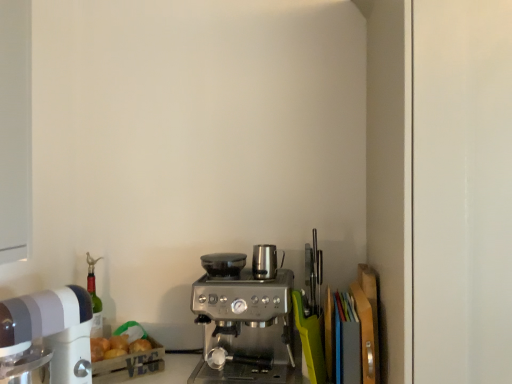
Describe the element at coordinates (52, 329) in the screenshot. I see `white plastic mixer at left` at that location.

Measure the distance between satin silver coffee maker at center and camera.

satin silver coffee maker at center and camera are 4.05 feet apart from each other.

The image size is (512, 384). Describe the element at coordinates (223, 264) in the screenshot. I see `satin silver espresso machine at center, acting as the 1th appliance starting from the left` at that location.

Where is `white plastic mixer at left`? This screenshot has width=512, height=384. white plastic mixer at left is located at coordinates (52, 329).

Which of these two, satin silver coffee maker at center or satin silver espresso machine at center, the 2th appliance positioned from the right, stands taller?

With more height is satin silver coffee maker at center.

Does satin silver coffee maker at center have a smaller size compared to satin silver espresso machine at center, acting as the 1th appliance starting from the left?

Actually, satin silver coffee maker at center might be larger than satin silver espresso machine at center, acting as the 1th appliance starting from the left.

In the scene shown: Is satin silver coffee maker at center positioned with its back to satin silver espresso machine at center, the 2th appliance positioned from the right?

No, satin silver coffee maker at center is not facing away from satin silver espresso machine at center, the 2th appliance positioned from the right.

Does satin silver coffee maker at center have a lesser width compared to satin silver espresso machine at center, the 2th appliance positioned from the right?

No, satin silver coffee maker at center is not thinner than satin silver espresso machine at center, the 2th appliance positioned from the right.

Between point (204, 257) and point (216, 383), which one is positioned behind?

The point (204, 257) is more distant.

Is satin silver espresso machine at center, acting as the 1th appliance starting from the left, positioned with its back to satin silver coffee maker at center?

No, satin silver coffee maker at center is not at the back of satin silver espresso machine at center, acting as the 1th appliance starting from the left.

Considering the positions of objects satin silver espresso machine at center, acting as the 1th appliance starting from the left, and satin silver coffee maker at center in the image provided, who is in front, satin silver espresso machine at center, acting as the 1th appliance starting from the left, or satin silver coffee maker at center?

Positioned in front is satin silver coffee maker at center.

From a real-world perspective, is white plastic mixer at left located higher than satin silver coffee maker at center?

Yes, from a real-world perspective, white plastic mixer at left is on top of satin silver coffee maker at center.

At what (x,y) coordinates should I click in order to perform the action: click on coffee maker on the right of white plastic mixer at left. Please return your answer as a coordinate pair (x, y). Looking at the image, I should click on (247, 328).

Is white plastic mixer at left bigger than satin silver coffee maker at center?

Incorrect, white plastic mixer at left is not larger than satin silver coffee maker at center.

Is white plastic mixer at left directly adjacent to satin silver coffee maker at center?

No, white plastic mixer at left is not beside satin silver coffee maker at center.

The height and width of the screenshot is (384, 512). In order to click on the 1st appliance above when counting from the white plastic mixer at left (from the image's perspective) in this screenshot , I will do `click(223, 264)`.

How much distance is there between satin silver espresso machine at center, acting as the 1th appliance starting from the left, and white plastic mixer at left?

The distance of satin silver espresso machine at center, acting as the 1th appliance starting from the left, from white plastic mixer at left is 17.66 inches.

Is satin silver espresso machine at center, the 2th appliance positioned from the right, oriented away from white plastic mixer at left?

No, satin silver espresso machine at center, the 2th appliance positioned from the right, is not facing the opposite direction of white plastic mixer at left.

Does point (216, 253) appear closer or farther from the camera than point (25, 317)?

Point (216, 253) is positioned farther from the camera compared to point (25, 317).

Does white plastic mixer at left have a greater height compared to satin silver espresso machine at center, the 2th appliance positioned from the right?

Indeed, white plastic mixer at left has a greater height compared to satin silver espresso machine at center, the 2th appliance positioned from the right.

Is point (60, 370) closer to camera compared to point (233, 255)?

Yes, point (60, 370) is closer to viewer.

Which object is more forward, white plastic mixer at left or satin silver espresso machine at center, acting as the 1th appliance starting from the left?

white plastic mixer at left.

Is white plastic mixer at left not near satin silver espresso machine at center, the 2th appliance positioned from the right?

They are positioned close to each other.

Is satin silver kettle at center, arranged as the 2th appliance when viewed from the left, oriented towards satin silver coffee maker at center?

No, satin silver kettle at center, arranged as the 2th appliance when viewed from the left, is not aimed at satin silver coffee maker at center.

From the image's perspective, relative to satin silver coffee maker at center, is satin silver kettle at center, the 1th appliance in the right-to-left sequence, above or below?

Based on their image positions, satin silver kettle at center, the 1th appliance in the right-to-left sequence, is located above satin silver coffee maker at center.

Is satin silver kettle at center, arranged as the 2th appliance when viewed from the left, at the left side of satin silver coffee maker at center?

Incorrect, satin silver kettle at center, arranged as the 2th appliance when viewed from the left, is not on the left side of satin silver coffee maker at center.

Considering the relative sizes of satin silver kettle at center, the 1th appliance in the right-to-left sequence, and satin silver coffee maker at center in the image provided, is satin silver kettle at center, the 1th appliance in the right-to-left sequence, taller than satin silver coffee maker at center?

No, satin silver kettle at center, the 1th appliance in the right-to-left sequence, is not taller than satin silver coffee maker at center.

Which of these two, satin silver espresso machine at center, the 2th appliance positioned from the right, or satin silver kettle at center, arranged as the 2th appliance when viewed from the left, stands shorter?

With less height is satin silver espresso machine at center, the 2th appliance positioned from the right.

Considering the positions of points (226, 261) and (267, 255), is point (226, 261) farther from camera compared to point (267, 255)?

That is False.

Is satin silver espresso machine at center, the 2th appliance positioned from the right, located outside satin silver kettle at center, arranged as the 2th appliance when viewed from the left?

satin silver espresso machine at center, the 2th appliance positioned from the right, lies outside satin silver kettle at center, arranged as the 2th appliance when viewed from the left,'s area.

Which is more to the right, satin silver espresso machine at center, acting as the 1th appliance starting from the left, or satin silver kettle at center, the 1th appliance in the right-to-left sequence?

Positioned to the right is satin silver kettle at center, the 1th appliance in the right-to-left sequence.

From the satin silver coffee maker at center, count 1st appliances backward and point to it. Please provide its 2D coordinates.

[(223, 264)]

I want to click on coffee maker in front of the satin silver espresso machine at center, acting as the 1th appliance starting from the left, so click(x=247, y=328).

Based on their spatial positions, is satin silver espresso machine at center, the 2th appliance positioned from the right, or satin silver coffee maker at center further from satin silver kettle at center, the 1th appliance in the right-to-left sequence?

satin silver coffee maker at center.

In the scene shown: From the image, which object appears to be farther from satin silver kettle at center, the 1th appliance in the right-to-left sequence, satin silver espresso machine at center, the 2th appliance positioned from the right, or white plastic mixer at left?

white plastic mixer at left lies further to satin silver kettle at center, the 1th appliance in the right-to-left sequence, than the other object.

From the image, which object appears to be nearer to satin silver espresso machine at center, the 2th appliance positioned from the right, satin silver kettle at center, the 1th appliance in the right-to-left sequence, or satin silver coffee maker at center?

Based on the image, satin silver kettle at center, the 1th appliance in the right-to-left sequence, appears to be nearer to satin silver espresso machine at center, the 2th appliance positioned from the right.

Based on the photo, looking at the image, which one is located closer to white plastic mixer at left, satin silver kettle at center, the 1th appliance in the right-to-left sequence, or satin silver coffee maker at center?

satin silver coffee maker at center lies closer to white plastic mixer at left than the other object.

Looking at the image, which one is located closer to satin silver coffee maker at center, satin silver espresso machine at center, acting as the 1th appliance starting from the left, or white plastic mixer at left?

Among the two, satin silver espresso machine at center, acting as the 1th appliance starting from the left, is located nearer to satin silver coffee maker at center.

From the picture: Considering their positions, is satin silver coffee maker at center positioned further to white plastic mixer at left than satin silver kettle at center, arranged as the 2th appliance when viewed from the left?

Based on the image, satin silver kettle at center, arranged as the 2th appliance when viewed from the left, appears to be further to white plastic mixer at left.

From the image, which object appears to be farther from white plastic mixer at left, satin silver espresso machine at center, the 2th appliance positioned from the right, or satin silver kettle at center, arranged as the 2th appliance when viewed from the left?

satin silver kettle at center, arranged as the 2th appliance when viewed from the left, is positioned further to the anchor white plastic mixer at left.

Looking at this image, from the image, which object appears to be farther from satin silver espresso machine at center, acting as the 1th appliance starting from the left, satin silver kettle at center, the 1th appliance in the right-to-left sequence, or white plastic mixer at left?

Based on the image, white plastic mixer at left appears to be further to satin silver espresso machine at center, acting as the 1th appliance starting from the left.

Locate an element on the screen. This screenshot has width=512, height=384. appliance between white plastic mixer at left and satin silver kettle at center, the 1th appliance in the right-to-left sequence, in the horizontal direction is located at coordinates (223, 264).

This screenshot has height=384, width=512. In order to click on appliance located between white plastic mixer at left and satin silver coffee maker at center in the left-right direction in this screenshot , I will do `click(223, 264)`.

Find the location of `appliance between satin silver kettle at center, arranged as the 2th appliance when viewed from the left, and satin silver coffee maker at center from top to bottom`. appliance between satin silver kettle at center, arranged as the 2th appliance when viewed from the left, and satin silver coffee maker at center from top to bottom is located at coordinates click(223, 264).

This screenshot has height=384, width=512. In order to click on coffee maker between white plastic mixer at left and satin silver kettle at center, arranged as the 2th appliance when viewed from the left in this screenshot , I will do `click(247, 328)`.